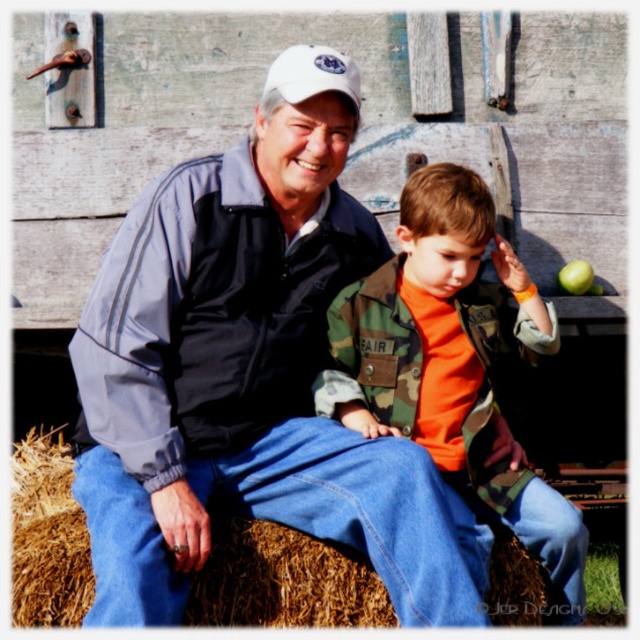
You are a photographer trying to capture a photo of the matte blue jacket at center and the white matte baseball cap at upper center. Which object should you focus on first if you want to ensure both are in sharp focus?

The white matte baseball cap at upper center is positioned above the matte blue jacket at center, so focusing on the white matte baseball cap at upper center first will help ensure both are in sharp focus as it is closer to the camera.

You are trying to decide whether to place a new decorative item on either the camouflage jacket at center or the brown straw bale at center. Considering their widths, which object would allow the item to fit better?

The camouflage jacket at center has a greater width than the brown straw bale at center, so placing the decorative item on the camouflage jacket at center would provide more space and a better fit.

You are a photographer trying to capture a photo of the matte blue jacket at center and the white matte baseball cap at upper center. If your camera can only focus on objects within a 1.2 meter width, will both objects fit in the frame?

The matte blue jacket at center might be wider than white matte baseball cap at upper center, but since the camera can focus on objects within 1.2 meters, both objects should fit as long as their combined width doesn